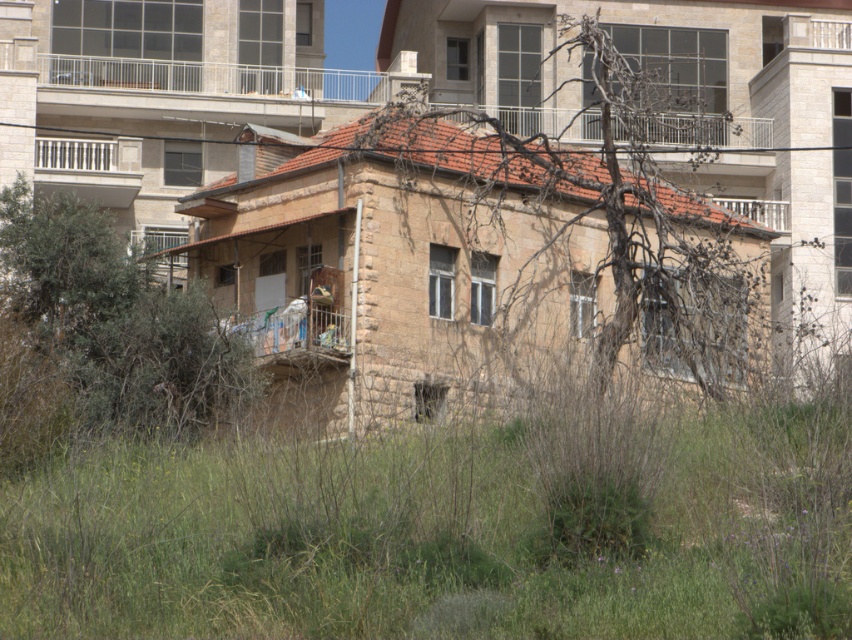
You are a window cleaner with a ladder that can reach up to 3 meters. You need to clean both the metallic silver balcony at upper center and the white metal balcony at upper right. Based on their sizes, which balcony will require you to move the ladder more frequently?

The metallic silver balcony at upper center has a larger size compared to the white metal balcony at upper right, so it will require moving the ladder more frequently due to its greater area needing coverage.

You are a window cleaner who needs to access both the white metal railing at upper center and the white metal balcony at upper right. Which one would require a longer ladder to reach?

The white metal railing at upper center is larger in size than the white metal balcony at upper right, so it would require a longer ladder to reach.